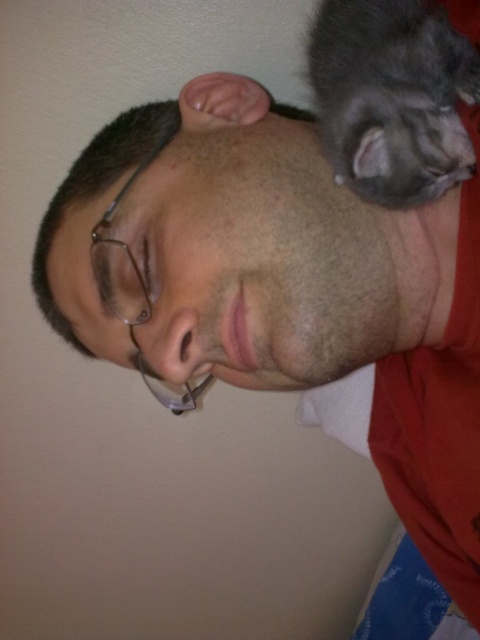
Question: Which of the following is the closest to the observer?

Choices:
 (A) matte black hair at upper center
 (B) gray fluffy cat at upper right

Answer: (B)

Question: Which point is closer to the camera?

Choices:
 (A) (355, 289)
 (B) (345, 80)

Answer: (B)

Question: Among these objects, which one is farthest from the camera?

Choices:
 (A) gray fluffy cat at upper right
 (B) matte black hair at upper center

Answer: (B)

Question: Does matte black hair at upper center appear under gray fluffy cat at upper right?

Choices:
 (A) no
 (B) yes

Answer: (B)

Question: Does matte black hair at upper center have a lesser width compared to gray fluffy cat at upper right?

Choices:
 (A) yes
 (B) no

Answer: (B)

Question: Does matte black hair at upper center appear under gray fluffy cat at upper right?

Choices:
 (A) yes
 (B) no

Answer: (A)